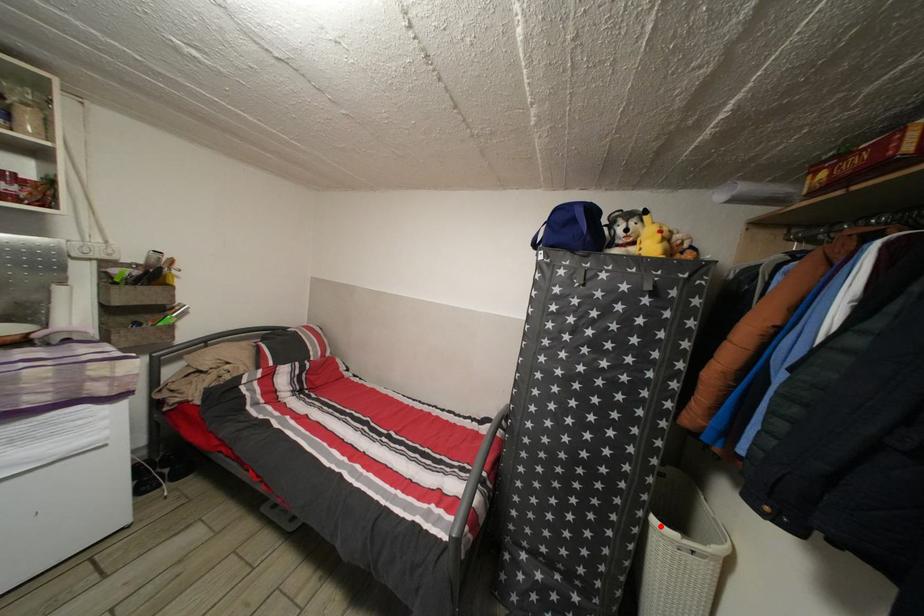
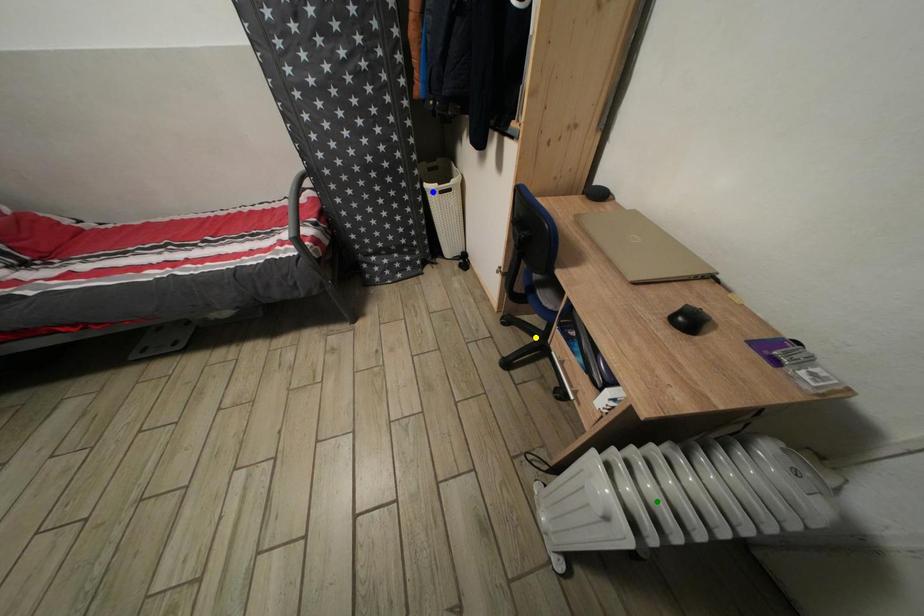
Question: I am providing you with two images of the same scene from different viewpoints. A red point is marked on the first image. You are given multiple points on the second image. Which point in image 2 is actually the same real-world point as the red point in image 1?

Choices:
 (A) green point
 (B) blue point
 (C) yellow point

Answer: (B)